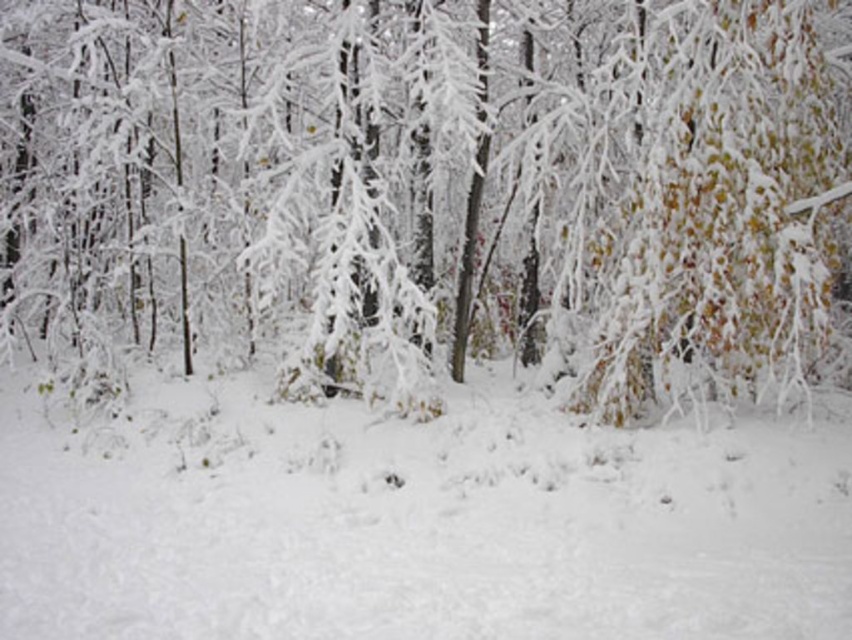
Question: Which point appears farthest from the camera in this image?

Choices:
 (A) click(263, 506)
 (B) click(751, 132)

Answer: (A)

Question: Which point is farther from the camera taking this photo?

Choices:
 (A) (439, 614)
 (B) (442, 83)

Answer: (B)

Question: Can you confirm if white frosty tree at center is bigger than white fluffy snow at center?

Choices:
 (A) no
 (B) yes

Answer: (B)

Question: Observing the image, what is the correct spatial positioning of white frosty tree at center in reference to white fluffy snow at center?

Choices:
 (A) above
 (B) below

Answer: (A)

Question: Does white frosty tree at center come behind white fluffy snow at center?

Choices:
 (A) no
 (B) yes

Answer: (B)